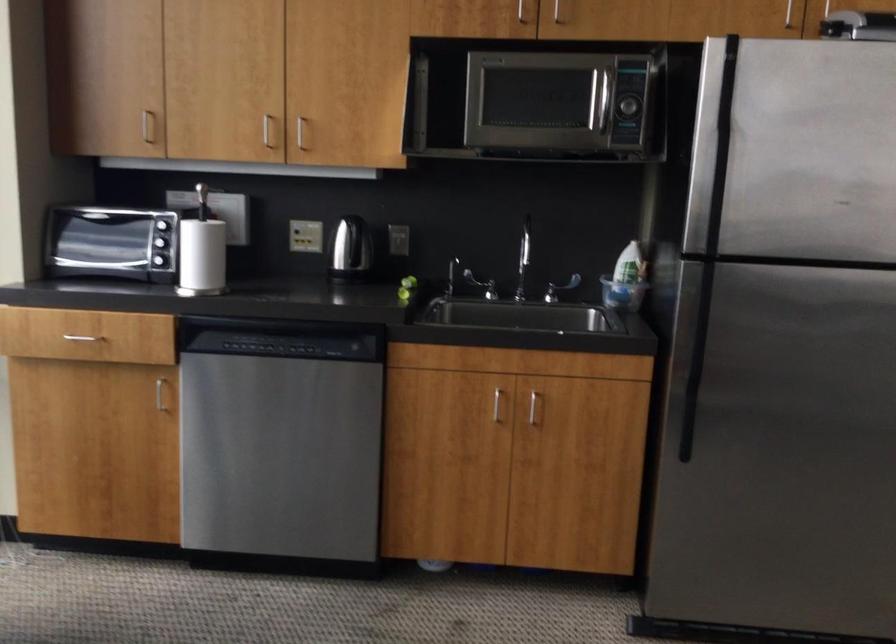
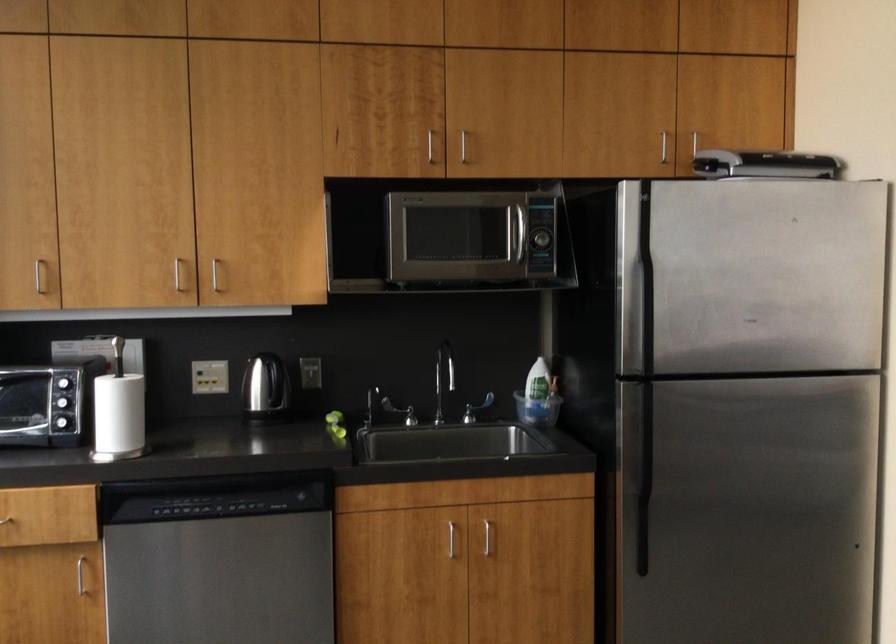
In the second image, find the point that corresponds to point (712, 136) in the first image.

(636, 267)